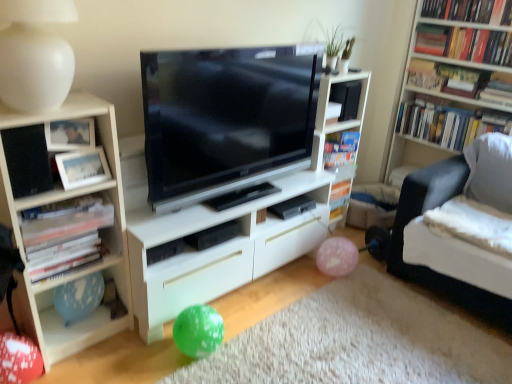
I want to click on vacant location below black glossy tv at center (from a real-world perspective), so click(x=225, y=201).